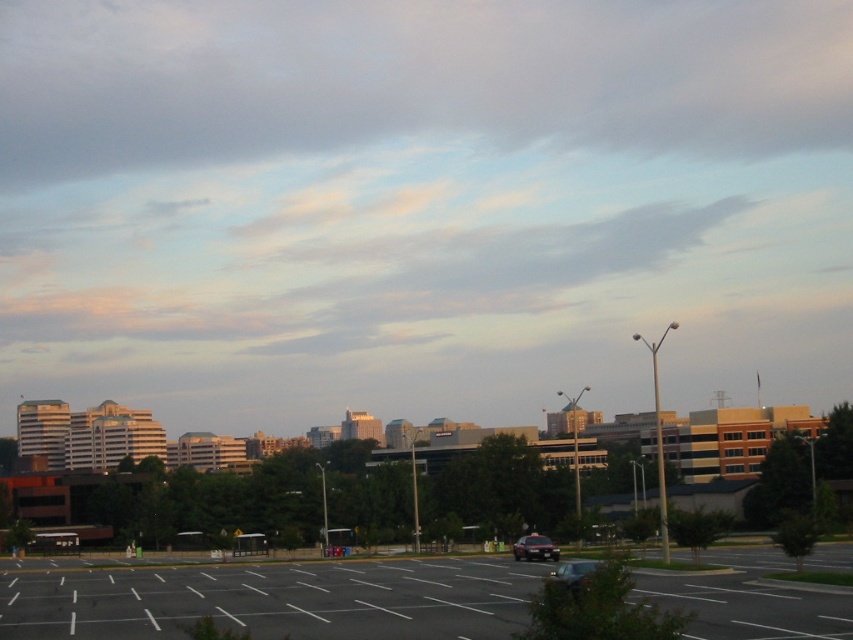
Does gray/cloudy sky at upper center have a greater height compared to metallic silver sedan at center?

Correct, gray/cloudy sky at upper center is much taller as metallic silver sedan at center.

At what (x,y) coordinates should I click in order to perform the action: click on gray/cloudy sky at upper center. Please return your answer as a coordinate pair (x, y). The width and height of the screenshot is (853, 640). Looking at the image, I should click on (412, 77).

Is point (755, 80) behind point (549, 550)?

Yes, it is behind point (549, 550).

Locate an element on the screen. The image size is (853, 640). gray/cloudy sky at upper center is located at coordinates (412, 77).

Can you confirm if gray/cloudy sky at upper center is positioned above pastel cotton clouds at upper center?

Yes.

Is gray/cloudy sky at upper center closer to the viewer compared to pastel cotton clouds at upper center?

Result: No, it is not.

The image size is (853, 640). Identify the location of gray/cloudy sky at upper center. (412, 77).

You are a GUI agent. You are given a task and a screenshot of the screen. Output one action in this format:
    pyautogui.click(x=<x>, y=<y>)
    Task: Click on the gray/cloudy sky at upper center
    
    Given the screenshot: What is the action you would take?
    pyautogui.click(x=412, y=77)

Does black asphalt parking lot at center appear under metallic silver sedan at lower center?

Correct, black asphalt parking lot at center is located below metallic silver sedan at lower center.

Is black asphalt parking lot at center above metallic silver sedan at lower center?

No.

Who is more forward, [726,556] or [555,579]?

Point [555,579] is more forward.

This screenshot has width=853, height=640. I want to click on black asphalt parking lot at center, so (x=271, y=600).